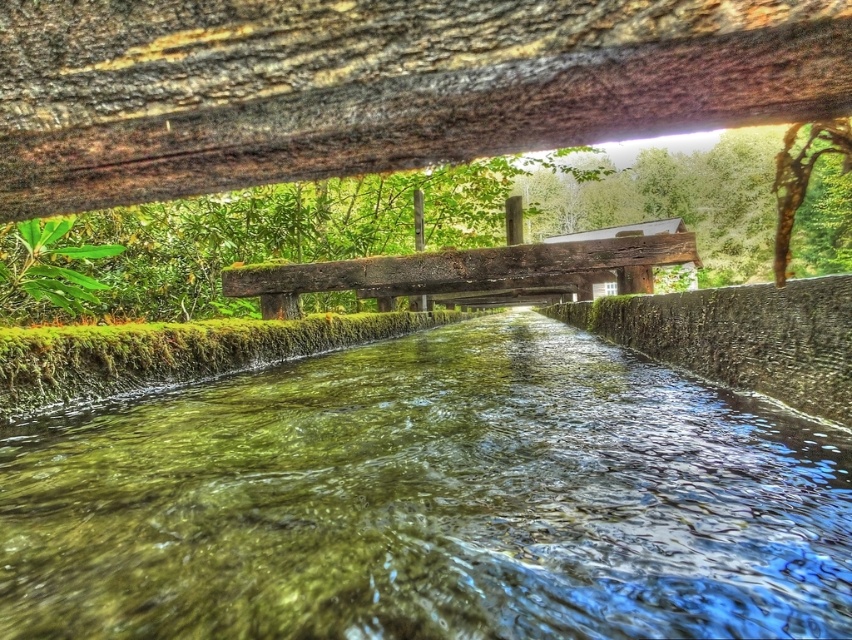
You are a photographer aiming to capture the entire rustic wooden bridge at center in your shot. Given that the green mossy river at center takes up more space in the frame, how might you adjust your camera angle to ensure the bridge is fully visible?

The green mossy river at center is larger than the rustic wooden bridge at center. To capture the entire bridge, you should zoom out or move back to include more of the bridge while reducing the portion of the river in the frame.

In the scene shown: You are standing on the rustic wooden bridge at center and want to see the green mossy river at center. Which direction should you look to see the river below you?

The green mossy river at center is shorter than rustic wooden bridge at center, so you should look downward to see the river below you.

You are a small toy boat that is 1 meter long. You want to sail down the green mossy river at center. The rustic wooden bridge at center is directly above the river. Can your boat pass under the bridge without getting stuck?

The green mossy river at center is narrower than the rustic wooden bridge at center, so the boat can pass under the bridge without getting stuck since the bridge is wider than the river.